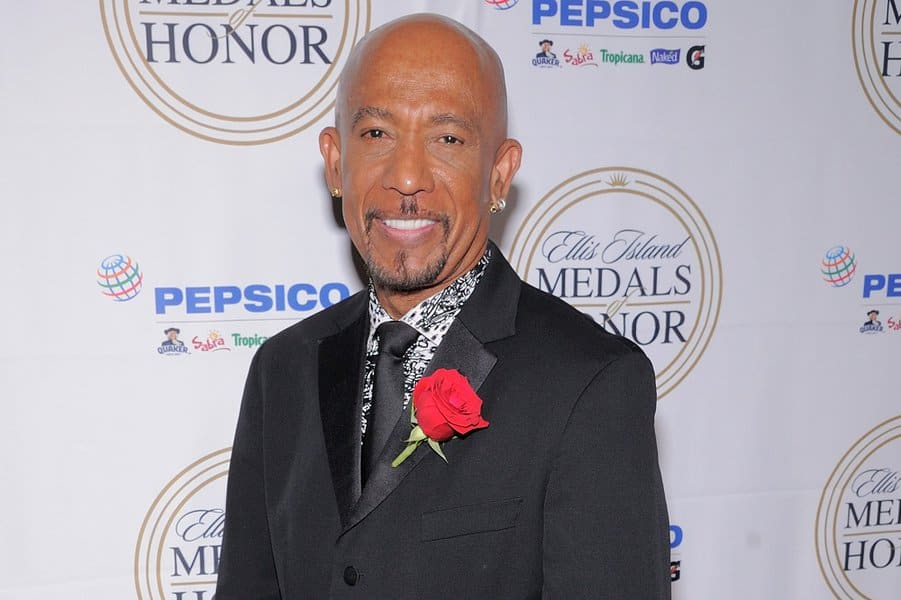
Locate an element on the screen. This screenshot has width=901, height=600. backdrop is located at coordinates (59, 185).